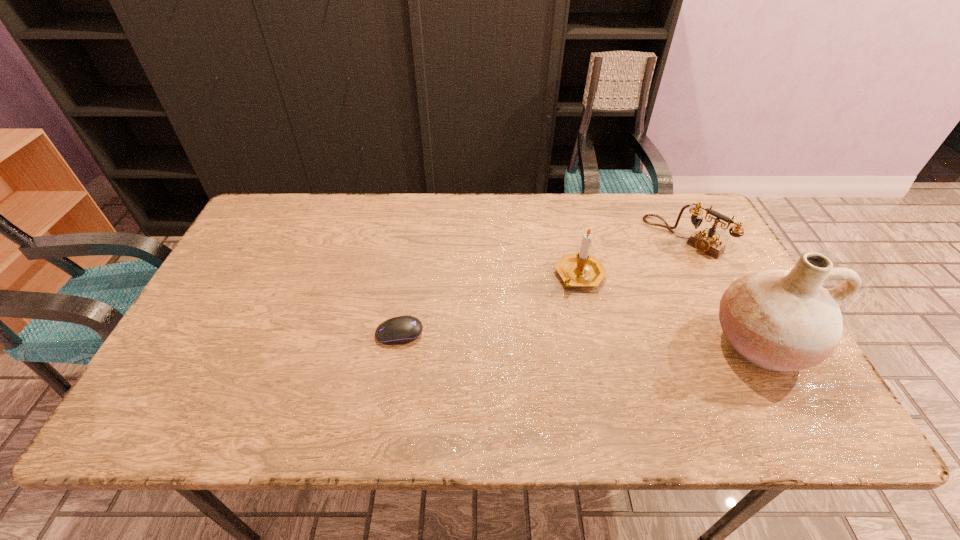
The width and height of the screenshot is (960, 540). I want to click on computer mouse, so click(x=404, y=329).

Find the location of `the leftmost object`. the leftmost object is located at coordinates (404, 329).

At what (x,y) coordinates should I click in order to perform the action: click on pottery. Please return your answer as a coordinate pair (x, y). Image resolution: width=960 pixels, height=540 pixels. Looking at the image, I should click on (780, 320).

I want to click on the second shortest object, so click(708, 243).

Find the location of `candle holder`. candle holder is located at coordinates (577, 269).

Where is `the third object from right to left`? the third object from right to left is located at coordinates (577, 269).

The height and width of the screenshot is (540, 960). In order to click on free location located on the left of the leftmost object in this screenshot , I will do `click(257, 333)`.

Locate an element on the screen. Image resolution: width=960 pixels, height=540 pixels. free space located 0.390m on the front-facing side of the second shortest object is located at coordinates (581, 323).

Locate an element on the screen. vacant area located 0.390m on the front-facing side of the second shortest object is located at coordinates (581, 323).

The height and width of the screenshot is (540, 960). Find the location of `free region located on the front-facing side of the second shortest object`. free region located on the front-facing side of the second shortest object is located at coordinates (652, 265).